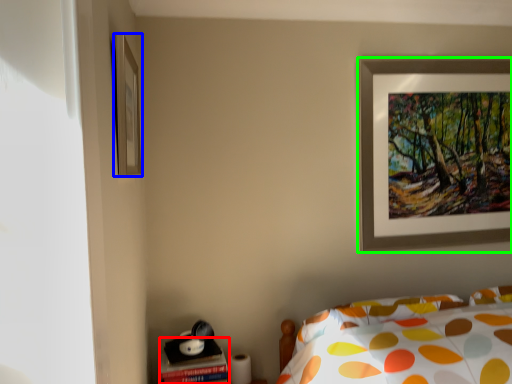
Question: Based on their relative distances, which object is farther from table (highlighted by a red box)? Choose from picture frame (highlighted by a blue box) and picture frame (highlighted by a green box).

Choices:
 (A) picture frame
 (B) picture frame

Answer: (B)